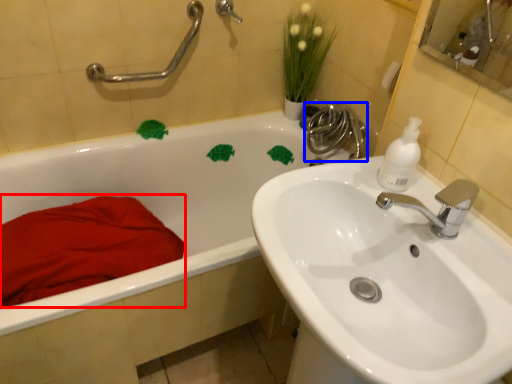
Question: Which object appears closest to the camera in this image, blanket (highlighted by a red box) or plumbing fixture (highlighted by a blue box)?

Choices:
 (A) blanket
 (B) plumbing fixture

Answer: (A)